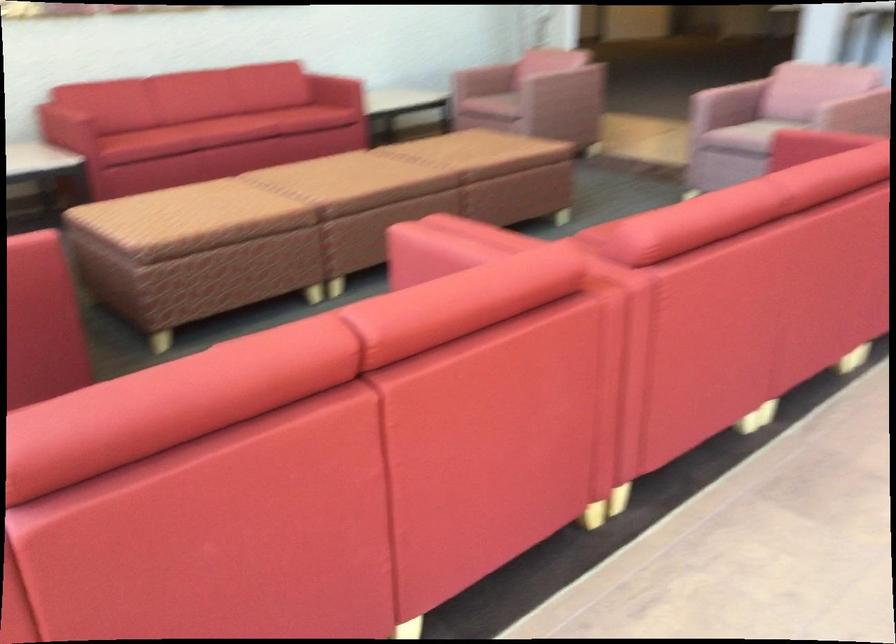
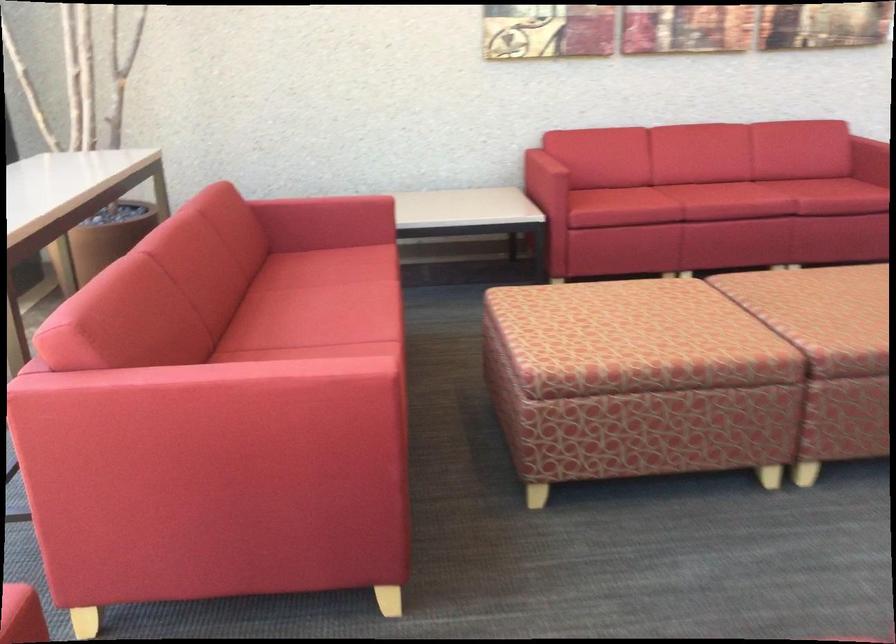
Find the pixel in the second image that matches point 73,114 in the first image.

(545, 166)